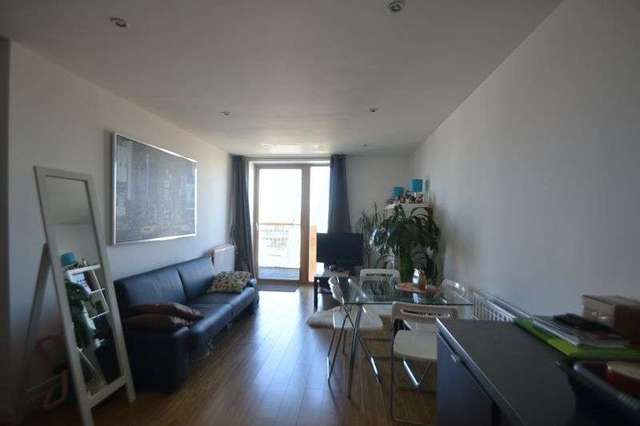
Where is `light glare on ceiling`? The height and width of the screenshot is (426, 640). light glare on ceiling is located at coordinates 287,147.